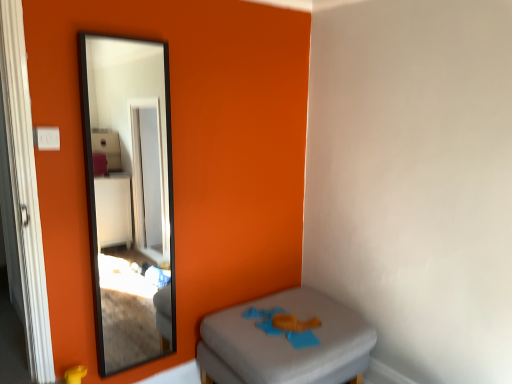
Question: Is gray fabric ottoman at lower right bigger than black glass mirror at upper left?

Choices:
 (A) no
 (B) yes

Answer: (B)

Question: Is gray fabric ottoman at lower right to the left of black glass mirror at upper left from the viewer's perspective?

Choices:
 (A) yes
 (B) no

Answer: (B)

Question: Does gray fabric ottoman at lower right come in front of black glass mirror at upper left?

Choices:
 (A) yes
 (B) no

Answer: (B)

Question: Is gray fabric ottoman at lower right turned away from black glass mirror at upper left?

Choices:
 (A) yes
 (B) no

Answer: (B)

Question: From a real-world perspective, is gray fabric ottoman at lower right on top of black glass mirror at upper left?

Choices:
 (A) no
 (B) yes

Answer: (A)

Question: From the image's perspective, is gray fabric ottoman at lower right located above black glass mirror at upper left?

Choices:
 (A) no
 (B) yes

Answer: (A)

Question: Considering the relative sizes of black glass mirror at upper left and gray fabric ottoman at lower right in the image provided, is black glass mirror at upper left taller than gray fabric ottoman at lower right?

Choices:
 (A) yes
 (B) no

Answer: (A)

Question: From the image's perspective, is black glass mirror at upper left located beneath gray fabric ottoman at lower right?

Choices:
 (A) yes
 (B) no

Answer: (B)

Question: Is black glass mirror at upper left far from gray fabric ottoman at lower right?

Choices:
 (A) no
 (B) yes

Answer: (B)

Question: From a real-world perspective, is black glass mirror at upper left over gray fabric ottoman at lower right?

Choices:
 (A) no
 (B) yes

Answer: (B)

Question: From the image's perspective, would you say black glass mirror at upper left is positioned over gray fabric ottoman at lower right?

Choices:
 (A) yes
 (B) no

Answer: (A)

Question: Is black glass mirror at upper left to the right of gray fabric ottoman at lower right from the viewer's perspective?

Choices:
 (A) no
 (B) yes

Answer: (A)

Question: Considering the positions of point (135, 258) and point (263, 337), is point (135, 258) closer or farther from the camera than point (263, 337)?

Choices:
 (A) closer
 (B) farther

Answer: (B)